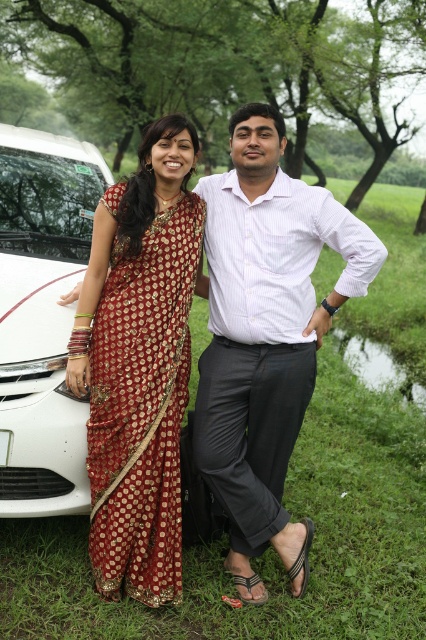
You are taking a photo in a park with two points marked in the scene. The first point is at coordinates point (293, 428) and the second is at point (48, 371). Which point is nearer to the camera?

Point (293, 428) is closer to the camera than point (48, 371).

You are a photographer trying to capture a clear shot of the white striped shirt at center and the white glossy car at left. Since both are white, you want to ensure they are spaced apart enough for the camera to focus on each individually. Given that the minimum required distance between two white objects for clear focus is 1 meter, can you confirm if the current spacing allows for this?

The white striped shirt at center and white glossy car at left are 1.09 meters apart, which exceeds the minimum required distance of 1 meter. Therefore, the current spacing allows for clear focus on each object individually.